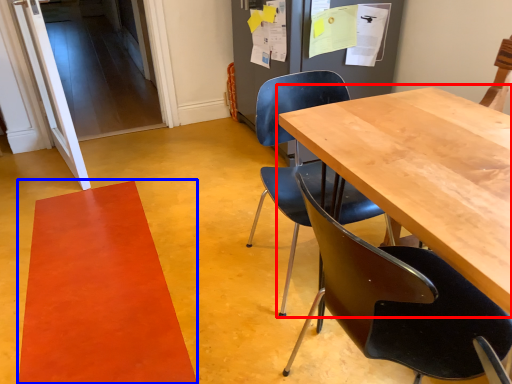
Question: Which object appears farthest to the camera in this image, table (highlighted by a red box) or mat (highlighted by a blue box)?

Choices:
 (A) table
 (B) mat

Answer: (B)